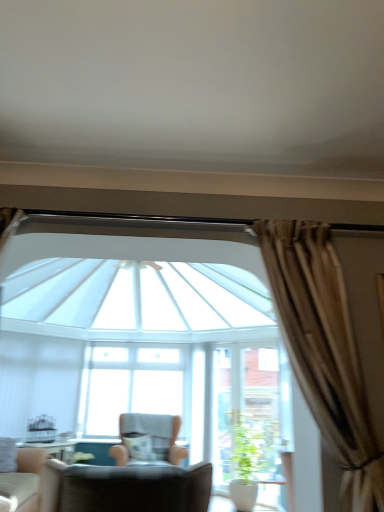
Where is `transparent glass window at center`? This screenshot has width=384, height=512. transparent glass window at center is located at coordinates (128, 386).

The width and height of the screenshot is (384, 512). In order to click on light beige fabric chair at lower left, marked as the 2th chair in a back-to-front arrangement in this screenshot , I will do `click(22, 482)`.

This screenshot has width=384, height=512. Describe the element at coordinates (247, 450) in the screenshot. I see `green matte plant at lower center` at that location.

The width and height of the screenshot is (384, 512). Describe the element at coordinates (125, 488) in the screenshot. I see `leather armchair at lower left, the 1th chair in the front-to-back sequence` at that location.

I want to click on white glass screen door at center, so click(250, 412).

Where is `transparent glass window at center`? transparent glass window at center is located at coordinates (128, 386).

Does green matte plant at lower center have a greater height compared to transparent glass window at center?

Incorrect, the height of green matte plant at lower center is not larger of that of transparent glass window at center.

Which of these two, green matte plant at lower center or transparent glass window at center, is bigger?

Bigger between the two is transparent glass window at center.

From the image's perspective, would you say green matte plant at lower center is shown under transparent glass window at center?

Yes, from the image's perspective, green matte plant at lower center is below transparent glass window at center.

Is green matte plant at lower center oriented away from transparent glass window at center?

That's not correct — green matte plant at lower center is not looking away from transparent glass window at center.

Is beige fabric chair at center, the 3th chair when ordered from front to back, oriented towards white glass screen door at center?

No, beige fabric chair at center, the 3th chair when ordered from front to back, is not facing towards white glass screen door at center.

Is beige fabric chair at center, the 1th chair when ordered from back to front, in contact with white glass screen door at center?

beige fabric chair at center, the 1th chair when ordered from back to front, and white glass screen door at center are clearly separated.

Between beige fabric chair at center, the 1th chair when ordered from back to front, and white glass screen door at center, which one has larger width?

beige fabric chair at center, the 1th chair when ordered from back to front, is wider.

From the picture: Who is more distant, transparent glass window at center or beige fabric chair at center, the 3th chair when ordered from front to back?

transparent glass window at center is further away from the camera.

How distant is transparent glass window at center from beige fabric chair at center, the 3th chair when ordered from front to back?

transparent glass window at center and beige fabric chair at center, the 3th chair when ordered from front to back, are 62.16 centimeters apart.

Is transparent glass window at center wider than beige fabric chair at center, the 3th chair when ordered from front to back?

No.

Does point (167, 406) appear closer or farther from the camera than point (155, 433)?

Point (167, 406) is positioned farther from the camera compared to point (155, 433).

Consider the image. Does white glass screen door at center turn towards green matte plant at lower center?

Yes, white glass screen door at center is aimed at green matte plant at lower center.

Can you confirm if white glass screen door at center is positioned to the right of green matte plant at lower center?

Indeed, white glass screen door at center is positioned on the right side of green matte plant at lower center.

How much distance is there between white glass screen door at center and green matte plant at lower center?

A distance of 15.94 centimeters exists between white glass screen door at center and green matte plant at lower center.

The width and height of the screenshot is (384, 512). Identify the location of screen door on the right of green matte plant at lower center. (250, 412).

Is point (130, 499) positioned after point (148, 395)?

No, it is in front of (148, 395).

Are leather armchair at lower left, the 1th chair in the front-to-back sequence, and transparent glass window at center making contact?

No, leather armchair at lower left, the 1th chair in the front-to-back sequence, is not beside transparent glass window at center.

Considering the relative sizes of leather armchair at lower left, the 1th chair in the front-to-back sequence, and transparent glass window at center in the image provided, is leather armchair at lower left, the 1th chair in the front-to-back sequence, bigger than transparent glass window at center?

Indeed, leather armchair at lower left, the 1th chair in the front-to-back sequence, has a larger size compared to transparent glass window at center.

Which of these two, leather armchair at lower left, the 1th chair in the front-to-back sequence, or transparent glass window at center, is thinner?

transparent glass window at center is thinner.

Is beige fabric chair at center, the 3th chair when ordered from front to back, not close to light beige fabric chair at lower left, the 2th chair in the front-to-back sequence?

Absolutely, beige fabric chair at center, the 3th chair when ordered from front to back, is distant from light beige fabric chair at lower left, the 2th chair in the front-to-back sequence.

In terms of width, does beige fabric chair at center, the 3th chair when ordered from front to back, look wider or thinner when compared to light beige fabric chair at lower left, the 2th chair in the front-to-back sequence?

Considering their sizes, beige fabric chair at center, the 3th chair when ordered from front to back, looks broader than light beige fabric chair at lower left, the 2th chair in the front-to-back sequence.

Is beige fabric chair at center, the 3th chair when ordered from front to back, taller or shorter than light beige fabric chair at lower left, marked as the 2th chair in a back-to-front arrangement?

Clearly, beige fabric chair at center, the 3th chair when ordered from front to back, is taller compared to light beige fabric chair at lower left, marked as the 2th chair in a back-to-front arrangement.

Does point (167, 415) appear closer or farther from the camera than point (14, 474)?

Point (167, 415).

Which is closer, (256, 437) or (162, 472)?

Point (256, 437) is farther from the camera than point (162, 472).

Is green matte plant at lower center looking in the opposite direction of leather armchair at lower left, the 1th chair in the front-to-back sequence?

No, green matte plant at lower center is not facing away from leather armchair at lower left, the 1th chair in the front-to-back sequence.

From the image's perspective, between green matte plant at lower center and leather armchair at lower left, the 1th chair in the front-to-back sequence, which one is located above?

leather armchair at lower left, the 1th chair in the front-to-back sequence, from the image's perspective.

Locate an element on the screen. The image size is (384, 512). window located above the green matte plant at lower center (from a real-world perspective) is located at coordinates (128, 386).

Where is `screen door on the right of beige fabric chair at center, the 3th chair when ordered from front to back`? The image size is (384, 512). screen door on the right of beige fabric chair at center, the 3th chair when ordered from front to back is located at coordinates (250, 412).

From the picture: Estimate the real-world distances between objects in this image. Which object is further from green matte plant at lower center, leather armchair at lower left, marked as the third chair in a back-to-front arrangement, or light beige fabric chair at lower left, the 2th chair in the front-to-back sequence?

Based on the image, light beige fabric chair at lower left, the 2th chair in the front-to-back sequence, appears to be further to green matte plant at lower center.

Based on their spatial positions, is transparent glass window at center or green matte plant at lower center closer to white glass screen door at center?

Among the two, green matte plant at lower center is located nearer to white glass screen door at center.

Based on the photo, based on their spatial positions, is green matte plant at lower center or beige fabric chair at center, the 3th chair when ordered from front to back, further from leather armchair at lower left, the 1th chair in the front-to-back sequence?

green matte plant at lower center is positioned further to the anchor leather armchair at lower left, the 1th chair in the front-to-back sequence.

Considering their positions, is light beige fabric chair at lower left, the 2th chair in the front-to-back sequence, positioned closer to white glass screen door at center than green matte plant at lower center?

The object closer to white glass screen door at center is green matte plant at lower center.

Which object lies further to the anchor point beige fabric chair at center, the 3th chair when ordered from front to back, transparent glass window at center or white glass screen door at center?

transparent glass window at center.

From the image, which object appears to be nearer to green matte plant at lower center, light beige fabric chair at lower left, the 2th chair in the front-to-back sequence, or white glass screen door at center?

white glass screen door at center is positioned closer to the anchor green matte plant at lower center.

Looking at this image, when comparing their distances from green matte plant at lower center, does white glass screen door at center or transparent glass window at center seem further?

transparent glass window at center.

Estimate the real-world distances between objects in this image. Which object is closer to light beige fabric chair at lower left, marked as the 2th chair in a back-to-front arrangement, leather armchair at lower left, the 1th chair in the front-to-back sequence, or transparent glass window at center?

transparent glass window at center lies closer to light beige fabric chair at lower left, marked as the 2th chair in a back-to-front arrangement, than the other object.

At what (x,y) coordinates should I click in order to perform the action: click on plant situated between beige fabric chair at center, the 1th chair when ordered from back to front, and white glass screen door at center from left to right. Please return your answer as a coordinate pair (x, y). The height and width of the screenshot is (512, 384). Looking at the image, I should click on (247, 450).

I want to click on plant between leather armchair at lower left, marked as the third chair in a back-to-front arrangement, and white glass screen door at center from front to back, so click(x=247, y=450).

You are a GUI agent. You are given a task and a screenshot of the screen. Output one action in this format:
    pyautogui.click(x=<x>, y=<y>)
    Task: Click on the plant located between leather armchair at lower left, the 1th chair in the front-to-back sequence, and beige fabric chair at center, the 1th chair when ordered from back to front, in the depth direction
    
    Given the screenshot: What is the action you would take?
    pyautogui.click(x=247, y=450)

The width and height of the screenshot is (384, 512). I want to click on chair between leather armchair at lower left, marked as the third chair in a back-to-front arrangement, and green matte plant at lower center in the front-back direction, so click(22, 482).